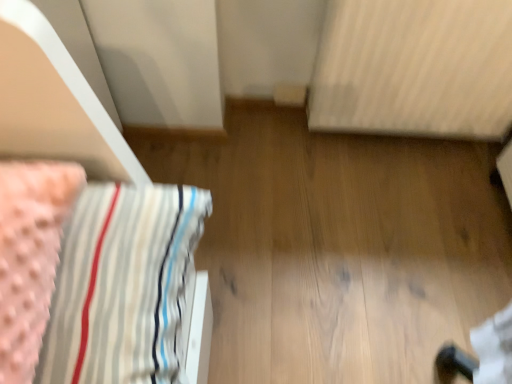
Question: Could you tell me if white textured radiator at upper right is turned towards pink fabric at left?

Choices:
 (A) yes
 (B) no

Answer: (B)

Question: Is white textured radiator at upper right positioned beyond the bounds of pink fabric at left?

Choices:
 (A) yes
 (B) no

Answer: (A)

Question: Is white textured radiator at upper right oriented away from pink fabric at left?

Choices:
 (A) no
 (B) yes

Answer: (A)

Question: From a real-world perspective, is white textured radiator at upper right physically below pink fabric at left?

Choices:
 (A) no
 (B) yes

Answer: (B)

Question: Would you say white textured radiator at upper right is a long distance from pink fabric at left?

Choices:
 (A) no
 (B) yes

Answer: (A)

Question: Can you confirm if white textured radiator at upper right is bigger than pink fabric at left?

Choices:
 (A) yes
 (B) no

Answer: (A)

Question: Is pink fabric at left turned away from white textured radiator at upper right?

Choices:
 (A) yes
 (B) no

Answer: (B)

Question: Is pink fabric at left shorter than white textured radiator at upper right?

Choices:
 (A) yes
 (B) no

Answer: (A)

Question: Is pink fabric at left to the left of white textured radiator at upper right from the viewer's perspective?

Choices:
 (A) yes
 (B) no

Answer: (A)

Question: Does pink fabric at left have a larger size compared to white textured radiator at upper right?

Choices:
 (A) no
 (B) yes

Answer: (A)

Question: Is pink fabric at left oriented towards white textured radiator at upper right?

Choices:
 (A) no
 (B) yes

Answer: (A)

Question: Does pink fabric at left come in front of white textured radiator at upper right?

Choices:
 (A) yes
 (B) no

Answer: (A)

Question: From a real-world perspective, is pink fabric at left physically located above or below white textured radiator at upper right?

Choices:
 (A) above
 (B) below

Answer: (A)